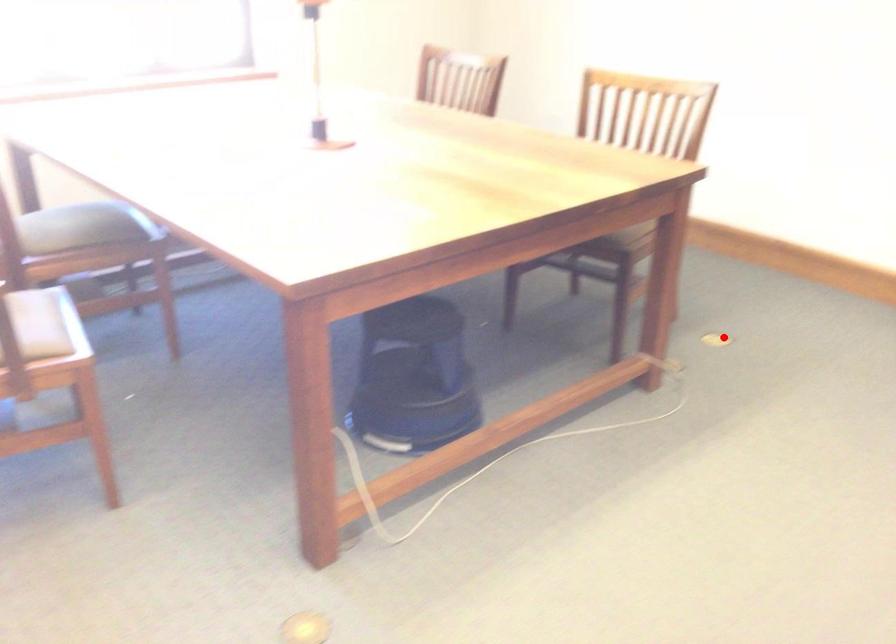
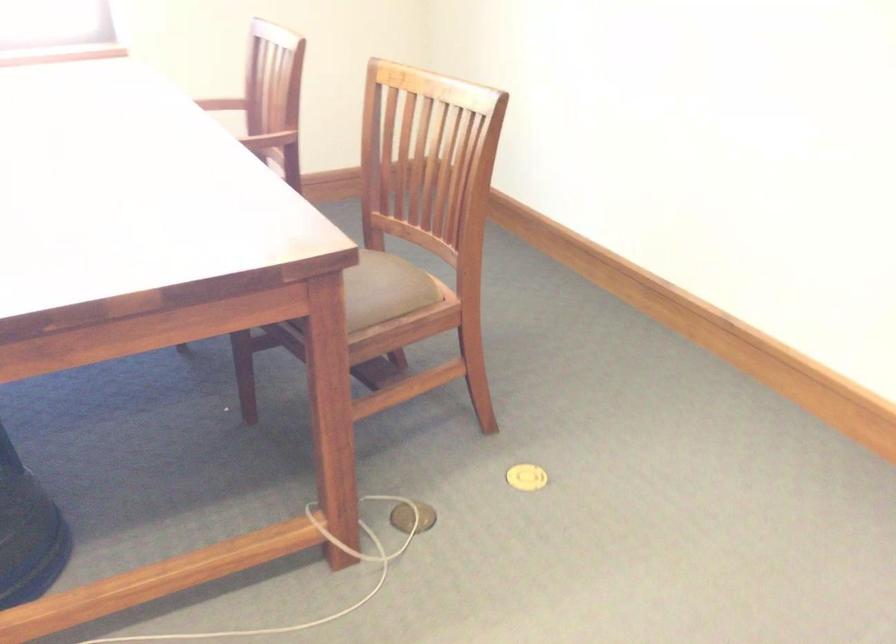
Question: I am providing you with two images of the same scene from different viewpoints. Given a red point in image1, look at the same physical point in image2. Is it:

Choices:
 (A) Closer to the viewpoint
 (B) Farther from the viewpoint

Answer: (A)